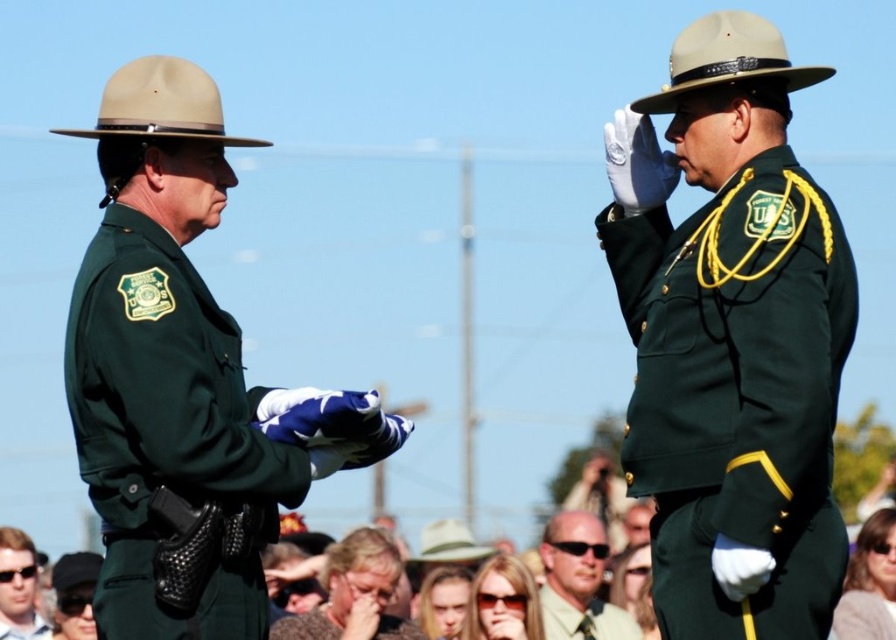
Question: Is the position of light brown leather sunglasses at center more distant than that of light brown fabric shirt at center?

Choices:
 (A) yes
 (B) no

Answer: (B)

Question: Can you confirm if green matte uniform at left is positioned to the right of light brown leather sunglasses at center?

Choices:
 (A) no
 (B) yes

Answer: (A)

Question: Which point is farther to the camera?

Choices:
 (A) (553, 612)
 (B) (605, 628)

Answer: (B)

Question: From the image, what is the correct spatial relationship of matte brown hair at center in relation to matte black sunglasses at lower left?

Choices:
 (A) right
 (B) left

Answer: (A)

Question: Which of the following is the closest to the observer?

Choices:
 (A) matte brown hair at center
 (B) green matte uniform at center
 (C) green matte uniform at right

Answer: (C)

Question: Which of the following is the farthest from the observer?

Choices:
 (A) (13, 577)
 (B) (407, 632)
 (C) (350, 540)

Answer: (A)